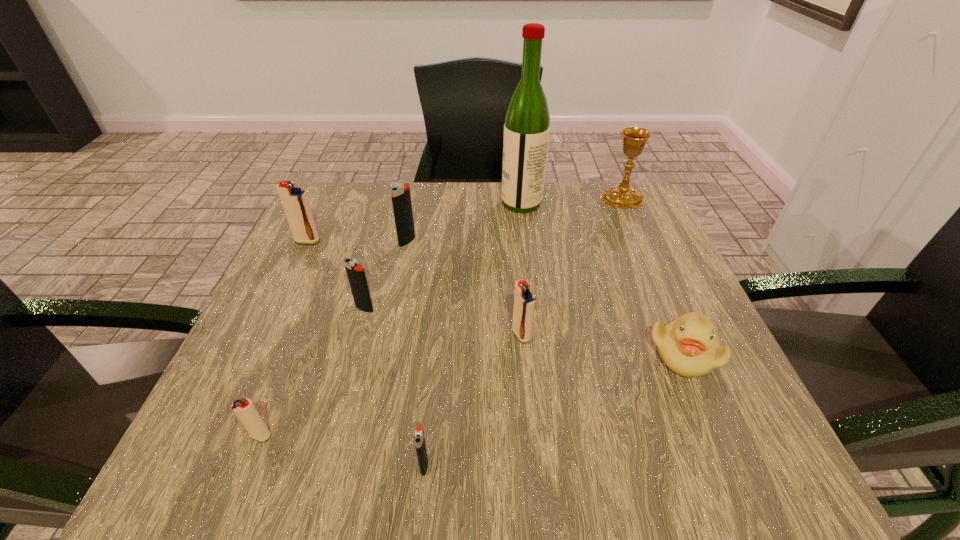
Find the location of a particular element. This screenshot has height=540, width=960. liquor is located at coordinates (527, 121).

Find the location of `green liquor`. green liquor is located at coordinates (527, 121).

You are a GUI agent. You are given a task and a screenshot of the screen. Output one action in this format:
    pyautogui.click(x=<x>, y=<y>)
    Task: Click on the gold chalice
    
    Given the screenshot: What is the action you would take?
    pyautogui.click(x=621, y=195)

Identify the location of the leftmost object. (295, 203).

Image resolution: width=960 pixels, height=540 pixels. I want to click on the leftmost igniter, so click(x=295, y=203).

This screenshot has height=540, width=960. What are the coordinates of `the biggest black igniter` in the screenshot? It's located at (400, 193).

Where is `the farthest black igniter`? This screenshot has height=540, width=960. the farthest black igniter is located at coordinates (400, 193).

Identify the location of the fifth farthest object. (356, 275).

What are the coordinates of `the third object from left to right` in the screenshot? It's located at (356, 275).

I want to click on the rightmost igniter, so click(524, 301).